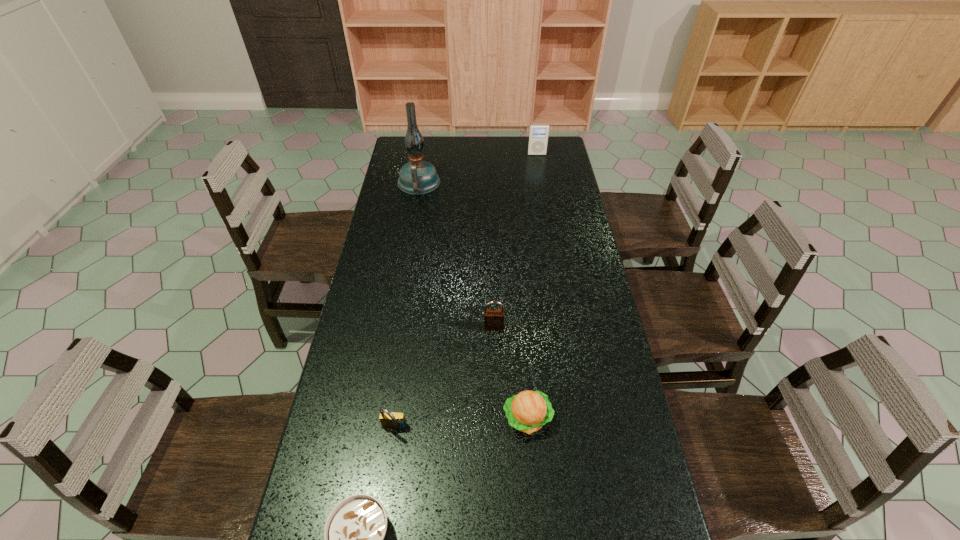
Identify the location of the second farthest object. (417, 177).

Where is `the tallest object`? The width and height of the screenshot is (960, 540). the tallest object is located at coordinates (417, 177).

I want to click on the rightmost object, so [x=538, y=136].

The height and width of the screenshot is (540, 960). In order to click on iPod in this screenshot , I will do `click(538, 136)`.

Find the location of a particular element. This screenshot has width=960, height=540. the farther padlock is located at coordinates (493, 318).

At what (x,y) coordinates should I click in order to perform the action: click on the right padlock. Please return your answer as a coordinate pair (x, y). This screenshot has width=960, height=540. Looking at the image, I should click on (493, 318).

At what (x,y) coordinates should I click in order to perform the action: click on the nearer padlock. Please return your answer as a coordinate pair (x, y). The image size is (960, 540). Looking at the image, I should click on (392, 420).

Locate an element on the screen. Image resolution: width=960 pixels, height=540 pixels. the shorter padlock is located at coordinates (392, 420).

In order to click on hamburger in this screenshot , I will do `click(528, 411)`.

Locate an element on the screen. This screenshot has width=960, height=540. free region located 0.160m on the right of the tallest object is located at coordinates (478, 183).